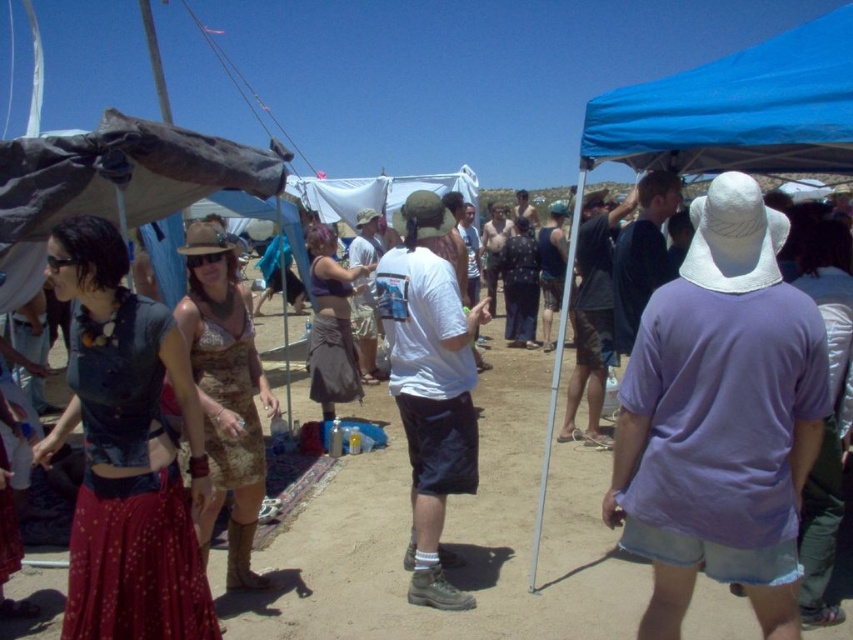
You are a photographer at the event and want to capture both the white cotton shirt at center and the camouflage dress at center in a single frame. Given that your camera has a fixed focal length, which subject should you position closer to the camera to ensure both fit in the frame?

Since the white cotton shirt at center is wider than the camouflage dress at center, you should position the narrower camouflage dress at center closer to the camera to ensure both fit within the frame.

You are at the festival and want to greet both the purple cotton shirt at center and the camouflage dress at center. Which one should you approach first if you want to greet the person closer to you?

You should approach the purple cotton shirt at center first because it is in front of the camouflage dress at center, making it closer to you.